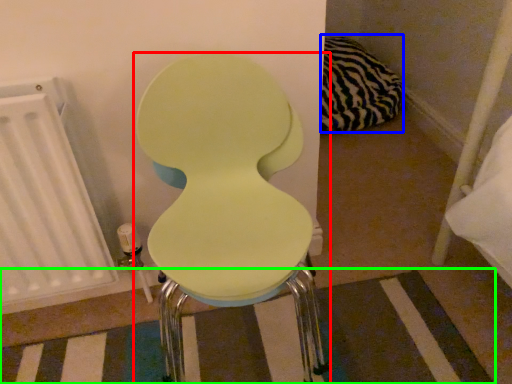
Question: Based on their relative distances, which object is nearer to toilet (highlighted by a red box)? Choose from pillow (highlighted by a blue box) and strip (highlighted by a green box).

Choices:
 (A) pillow
 (B) strip

Answer: (B)